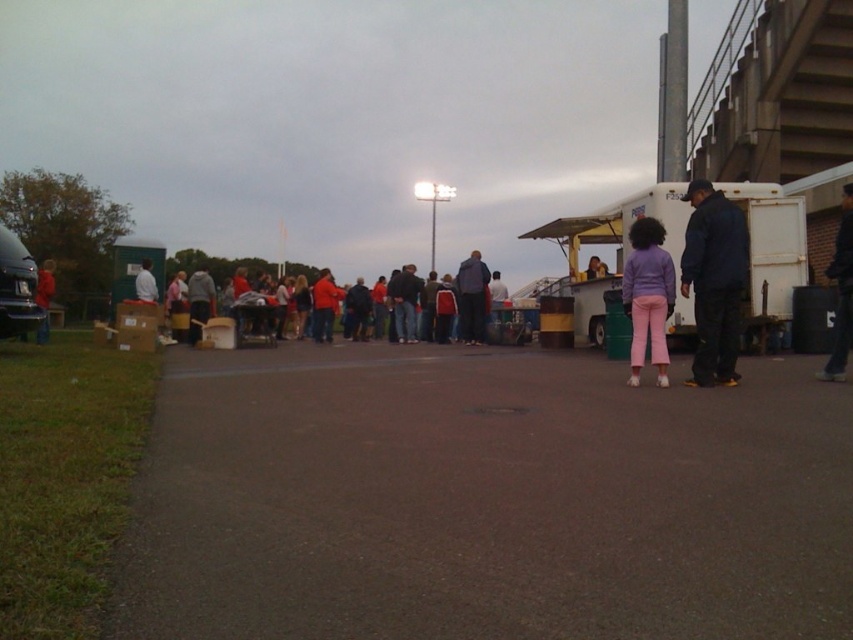
Can you confirm if dark gray jacket at center is thinner than matte red jacket at center?

Yes.

Where is `dark gray jacket at center`? dark gray jacket at center is located at coordinates (471, 298).

Who is more forward, (468, 284) or (332, 296)?

Point (468, 284) is in front.

Find the location of a particular element. dark gray jacket at center is located at coordinates (471, 298).

Does dark gray jacket at center appear on the left side of dark blue jeans at center?

In fact, dark gray jacket at center is to the right of dark blue jeans at center.

Is point (469, 305) positioned before point (392, 298)?

That is True.

Image resolution: width=853 pixels, height=640 pixels. What are the coordinates of `dark gray jacket at center` in the screenshot? It's located at (471, 298).

Which is above, gray hoodie at center or white matte shirt at center?

gray hoodie at center is above.

Between point (187, 291) and point (140, 284), which one is positioned behind?

The point (187, 291) is behind.

Identify the location of gray hoodie at center. (199, 301).